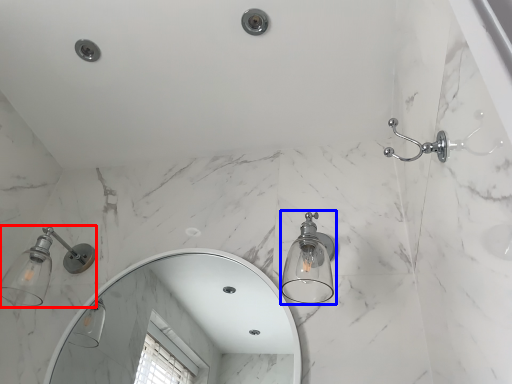
Question: Which of the following is the closest to the observer, light fixture (highlighted by a red box) or light fixture (highlighted by a blue box)?

Choices:
 (A) light fixture
 (B) light fixture

Answer: (B)